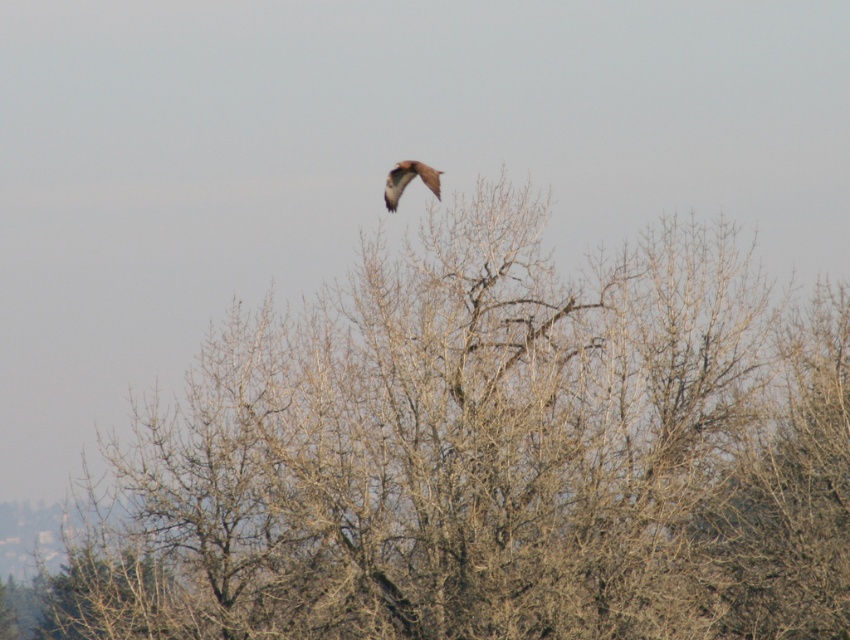
The height and width of the screenshot is (640, 850). What do you see at coordinates (488, 456) in the screenshot?
I see `bare branches at center` at bounding box center [488, 456].

Can you confirm if bare branches at center is shorter than brown feathered bird at upper center?

Incorrect, bare branches at center's height does not fall short of brown feathered bird at upper center's.

Is point (326, 497) positioned behind point (437, 177)?

No, (326, 497) is closer to viewer.

Image resolution: width=850 pixels, height=640 pixels. I want to click on bare branches at center, so click(488, 456).